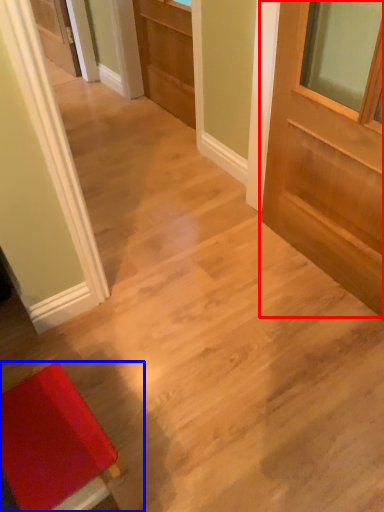
Question: Which object is closer to the camera taking this photo, door (highlighted by a red box) or furniture (highlighted by a blue box)?

Choices:
 (A) door
 (B) furniture

Answer: (B)